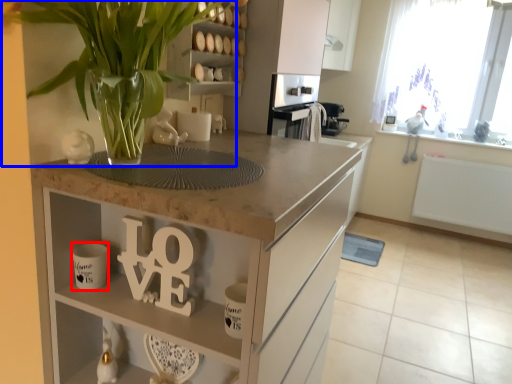
Question: Among these objects, which one is nearest to the camera, mug (highlighted by a red box) or houseplant (highlighted by a blue box)?

Choices:
 (A) mug
 (B) houseplant

Answer: (B)